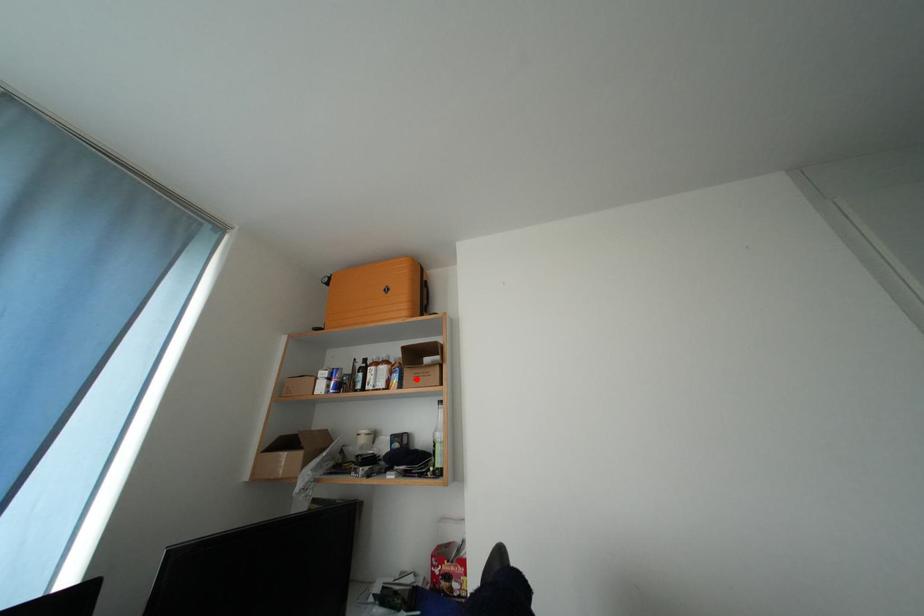
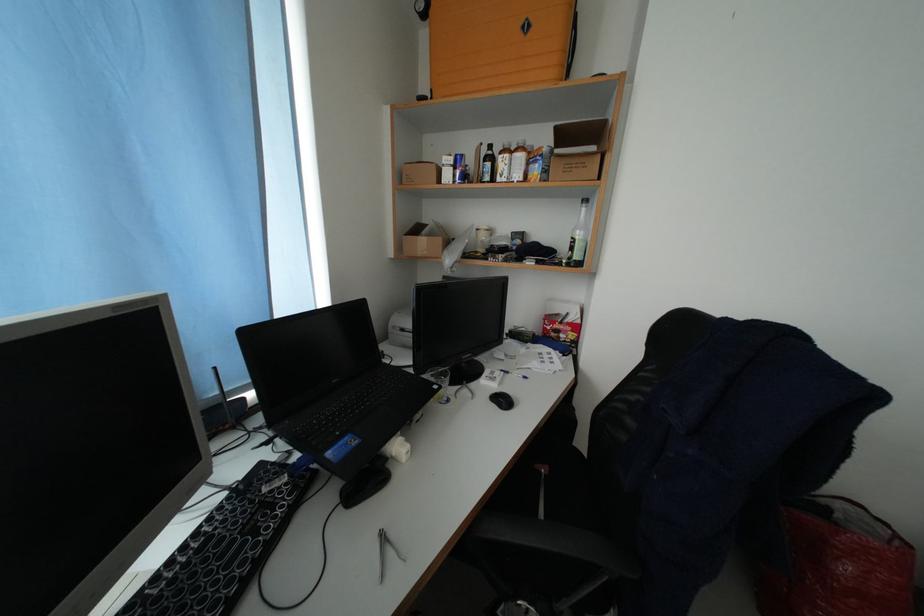
Find the pixel in the second image that matches the highlighted location in the first image.

(563, 169)